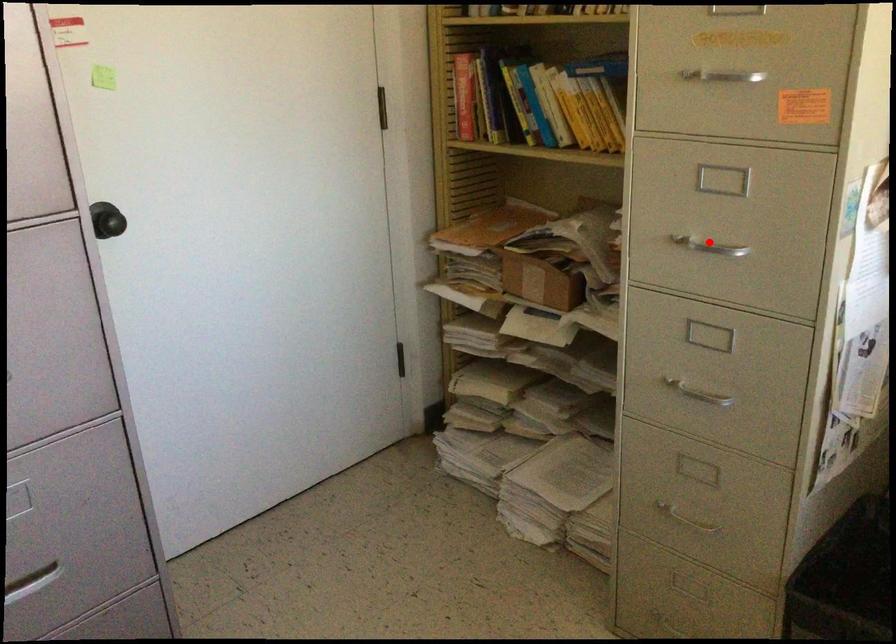
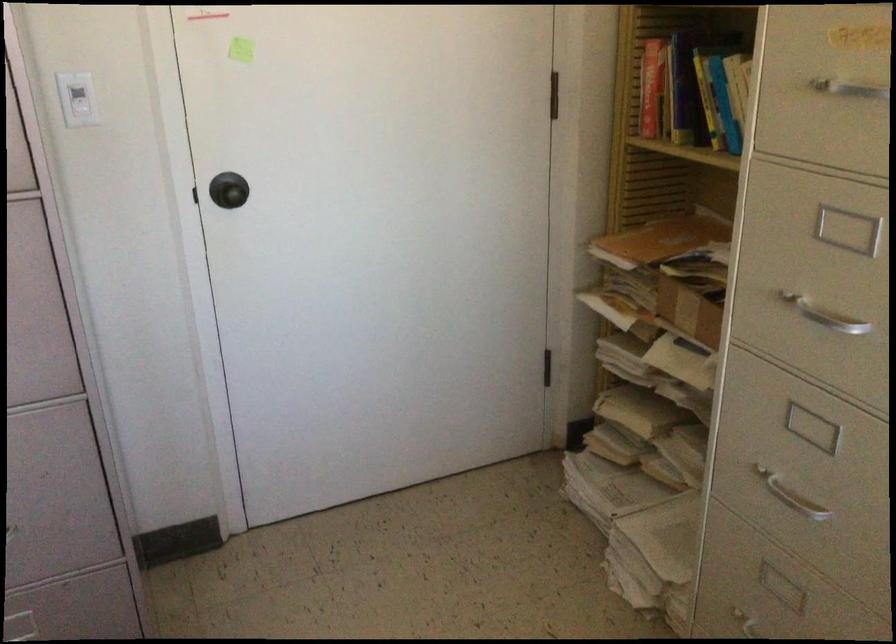
Question: I am providing you with two images of the same scene from different viewpoints. A red point is marked on the first image. At the location where the point appears in image 1, is it still visible in image 2?

Choices:
 (A) Yes
 (B) No

Answer: (A)